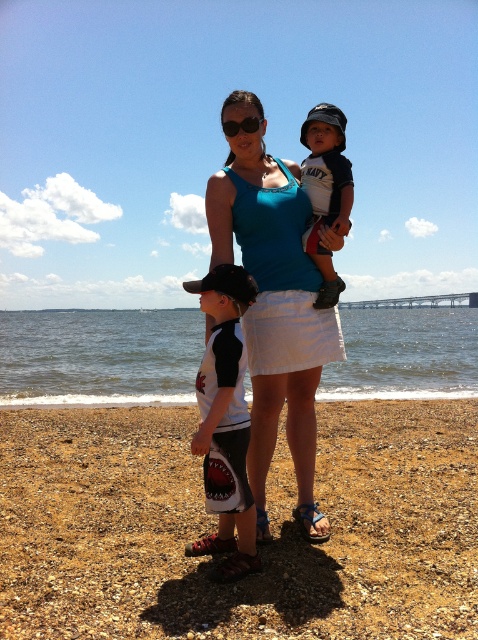
You are a photographer trying to capture the scene. The blue fabric tank top at center is represented by point (273,305). If you want to focus on the blue fabric tank top at center, which direction should you adjust your camera? Please answer with a direction like north, south, east, west, or a combination like northeast.

The blue fabric tank top at center is already at the center point (273,305), so no adjustment is needed. Keep the camera focused there.